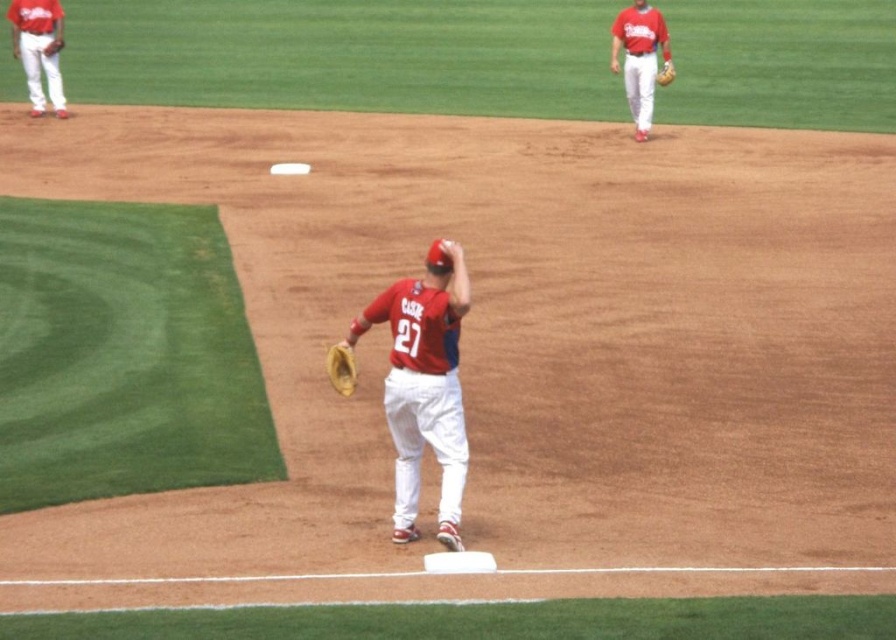
Question: Which object is closer to the camera taking this photo?

Choices:
 (A) brown leather glove at center
 (B) matte red baseball glove at center

Answer: (B)

Question: Which is farther from the matte red jersey at upper right?

Choices:
 (A) matte red baseball glove at center
 (B) brown leather glove at center
 (C) white matte pants at upper left
 (D) brown leather glove at upper right

Answer: (A)

Question: Considering the relative positions of matte red baseball glove at center and brown leather glove at center in the image provided, where is matte red baseball glove at center located with respect to brown leather glove at center?

Choices:
 (A) left
 (B) right

Answer: (B)

Question: Which is farther from the matte red baseball glove at center?

Choices:
 (A) matte red jersey at upper right
 (B) brown leather glove at center

Answer: (A)

Question: Does brown leather glove at center have a larger size compared to brown leather glove at upper right?

Choices:
 (A) no
 (B) yes

Answer: (A)

Question: Observing the image, what is the correct spatial positioning of white matte pants at upper left in reference to brown leather glove at center?

Choices:
 (A) right
 (B) left

Answer: (B)